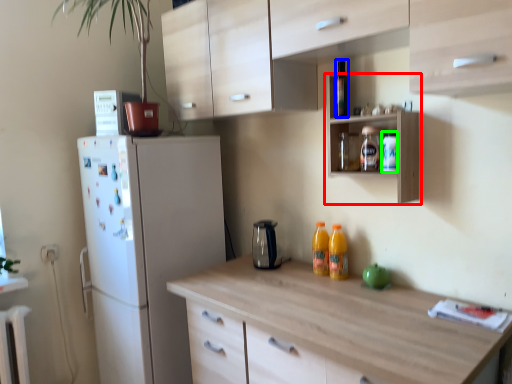
Question: Estimate the real-world distances between objects in this image. Which object is farther from shelf (highlighted by a red box), bottle (highlighted by a blue box) or bottle (highlighted by a green box)?

Choices:
 (A) bottle
 (B) bottle

Answer: (A)